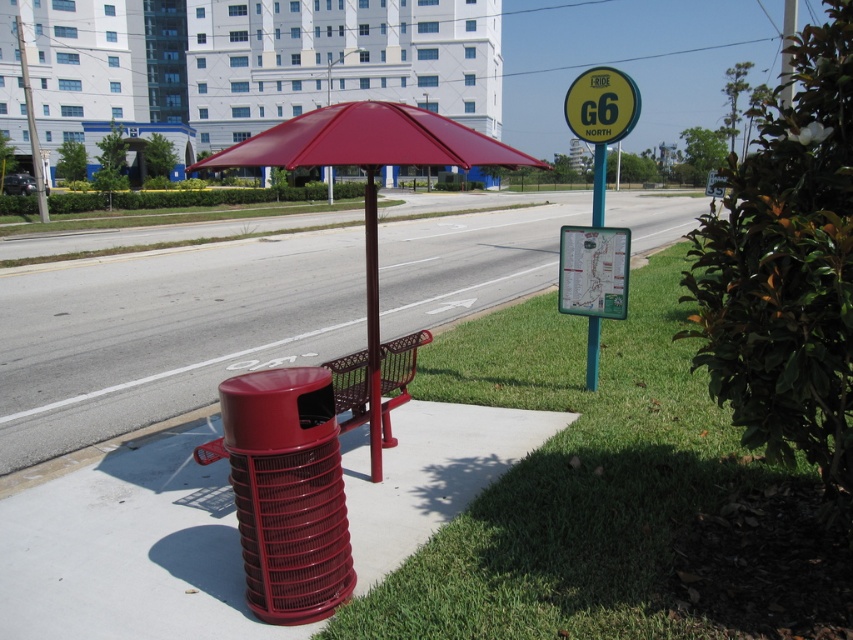
You are standing at the bus stop and need to dispose of a small piece of paper. The glossy plastic trash can at lower left is your only option. Can you confirm its exact location relative to the bench?

The glossy plastic trash can at lower left is located at coordinates point (163,333), which places it near the lower left area relative to the bench.

You are waiting at the bus stop and need to know which object is bigger between the matte red umbrella at center and the blue metallic pole at upper center. Can you tell me?

The matte red umbrella at center is larger in size than the blue metallic pole at upper center.